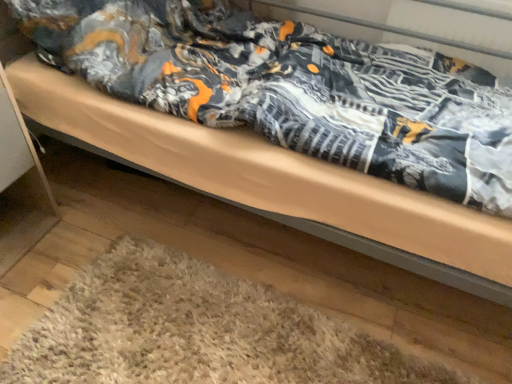
Question: Should I look upward or downward to see beige shaggy rug at lower center?

Choices:
 (A) up
 (B) down

Answer: (B)